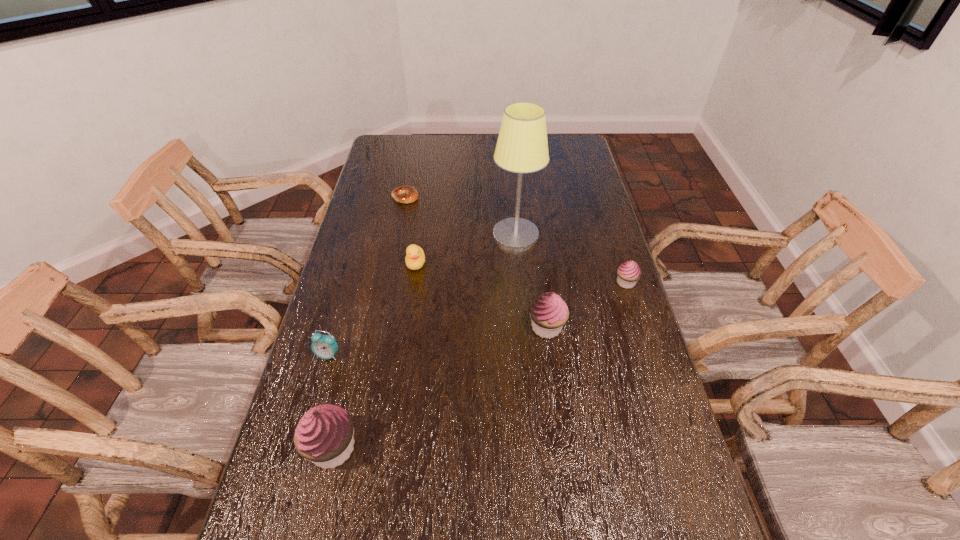
Locate an element on the screen. The height and width of the screenshot is (540, 960). object that is the second closest to the alarm clock is located at coordinates (415, 257).

This screenshot has width=960, height=540. I want to click on the closest cupcake to the fifth nearest object, so pos(549,312).

Identify which cupcake is the third closest to the fifth nearest object. Please provide its 2D coordinates. Your answer should be formatted as a tuple, i.e. [(x, y)], where the tuple contains the x and y coordinates of a point satisfying the conditions above.

[(629, 272)]

I want to click on vacant space that satisfies the following two spatial constraints: 1. on the face of the fourth nearest object; 2. on the right side of the duckling, so click(413, 282).

Find the location of a particular element. vacant space that satisfies the following two spatial constraints: 1. on the face of the second nearest object; 2. on the right side of the leftmost cupcake is located at coordinates (302, 448).

The width and height of the screenshot is (960, 540). In order to click on vacant space that satisfies the following two spatial constraints: 1. on the face of the farthest cupcake; 2. on the left side of the fifth nearest object in this screenshot , I will do `click(413, 282)`.

Identify the location of blank area in the image that satisfies the following two spatial constraints: 1. on the face of the nearest cupcake; 2. on the left side of the alarm clock. (302, 448).